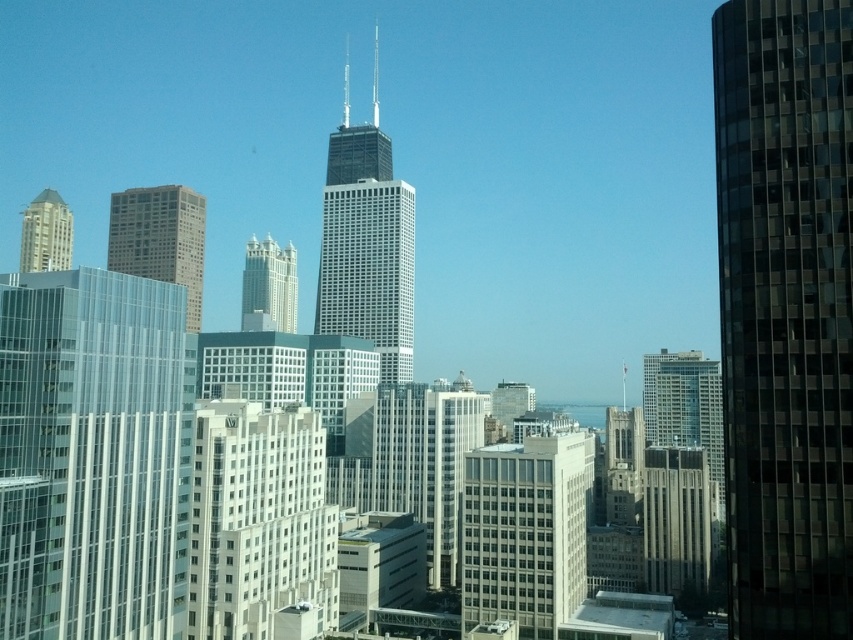
Is white glass building at center positioned behind matte gold building at upper left?

No.

In the scene shown: Who is lower down, white glass building at center or matte gold building at upper left?

white glass building at center

Locate an element on the screen. white glass building at center is located at coordinates (268, 285).

This screenshot has width=853, height=640. What are the coordinates of `white glass building at center` in the screenshot? It's located at (268, 285).

Does beige glass building at center appear over matte gold building at upper left?

Actually, beige glass building at center is below matte gold building at upper left.

Which is behind, point (553, 460) or point (26, 205)?

The point (26, 205) is behind.

Identify the location of beige glass building at center. (526, 531).

Between black glass skyscraper at right and matte glass skyscraper at center, which one has more height?

matte glass skyscraper at center is taller.

Does black glass skyscraper at right have a smaller size compared to matte glass skyscraper at center?

Indeed, black glass skyscraper at right has a smaller size compared to matte glass skyscraper at center.

I want to click on black glass skyscraper at right, so click(785, 310).